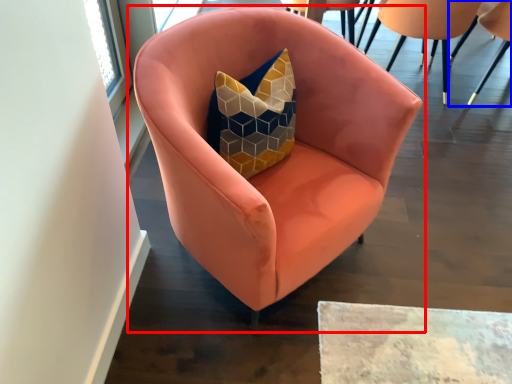
Question: Among these objects, which one is nearest to the camera, chair (highlighted by a red box) or chair (highlighted by a blue box)?

Choices:
 (A) chair
 (B) chair

Answer: (A)